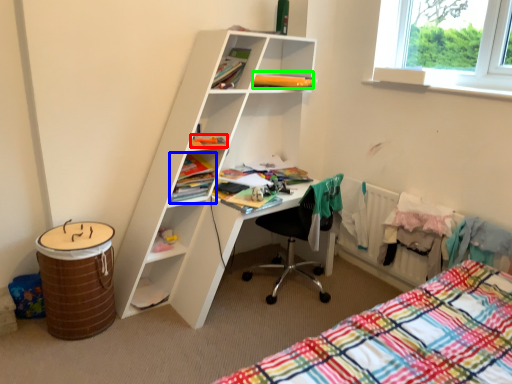
Question: Which is farther away from book (highlighted by a red box)? book (highlighted by a blue box) or book (highlighted by a green box)?

Choices:
 (A) book
 (B) book

Answer: (B)